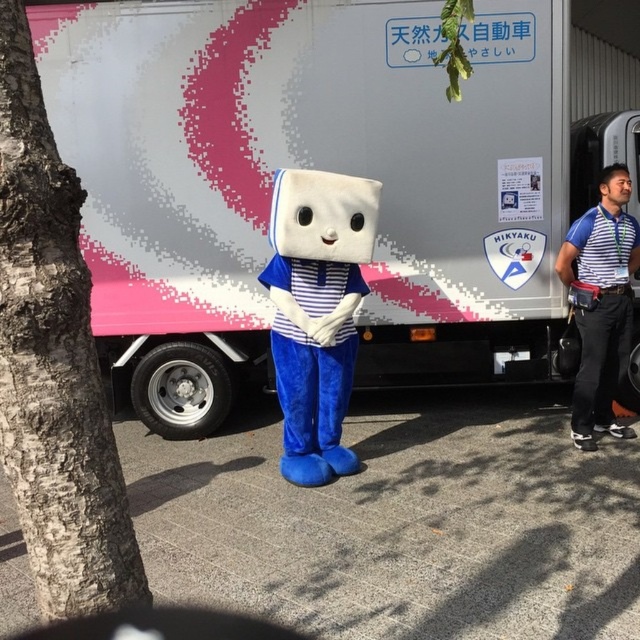
Question: Which point appears closest to the camera in this image?

Choices:
 (A) (477, 19)
 (B) (340, 323)

Answer: (B)

Question: Is white plush mascot at center above blue striped shirt at right?

Choices:
 (A) no
 (B) yes

Answer: (A)

Question: Can you confirm if white plush mascot at center is positioned to the right of blue striped shirt at right?

Choices:
 (A) yes
 (B) no

Answer: (B)

Question: Which of these objects is positioned farthest from the blue striped shirt at right?

Choices:
 (A) white matte truck at center
 (B) white plush mascot at center

Answer: (B)

Question: Which point is farther to the camera?

Choices:
 (A) (296, 451)
 (B) (320, 32)

Answer: (B)

Question: Is white matte truck at center below blue striped shirt at right?

Choices:
 (A) no
 (B) yes

Answer: (A)